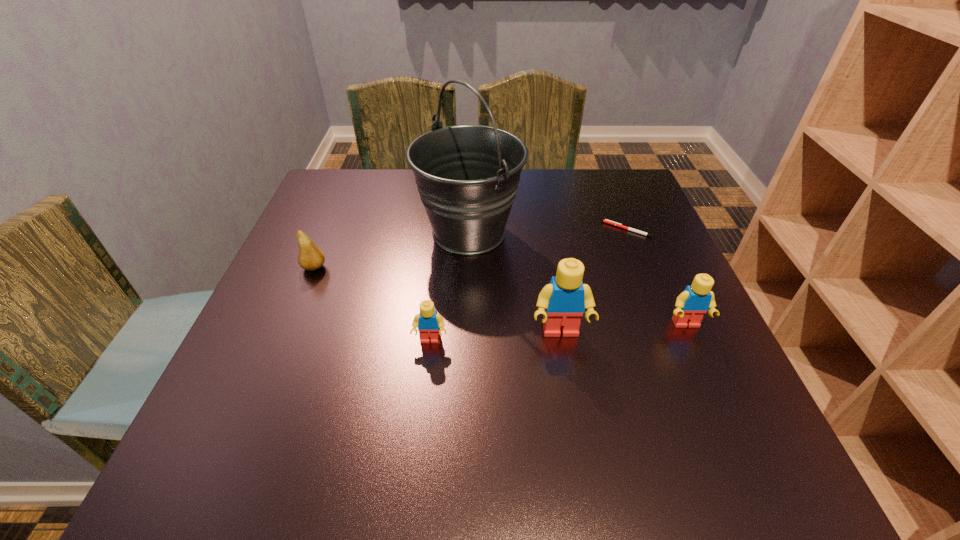
Locate an element on the screen. Image resolution: width=960 pixels, height=540 pixels. vacant space situated 0.150m on the front-facing side of the third tallest object is located at coordinates (720, 402).

At what (x,y) coordinates should I click in order to perform the action: click on vacant area situated on the clicker of the pen. Please return your answer as a coordinate pair (x, y). Looking at the image, I should click on (552, 230).

Where is `vacant space located on the clicker of the pen`? The height and width of the screenshot is (540, 960). vacant space located on the clicker of the pen is located at coordinates (543, 230).

You are a GUI agent. You are given a task and a screenshot of the screen. Output one action in this format:
    pyautogui.click(x=<x>, y=<y>)
    Task: Click on the vacant space located 0.300m on the clicker of the pen
    
    Given the screenshot: What is the action you would take?
    pyautogui.click(x=484, y=230)

Find the location of `vacant region located 0.290m on the left of the tallest object`. vacant region located 0.290m on the left of the tallest object is located at coordinates (300, 233).

Identify the location of vacant space located 0.210m on the front of the pear. (279, 352).

Locate an element on the screen. The width and height of the screenshot is (960, 540). object at the far edge is located at coordinates (467, 176).

You are a GUI agent. You are given a task and a screenshot of the screen. Output one action in this format:
    pyautogui.click(x=<x>, y=<y>)
    Task: Click on the object situated at the left edge
    
    Given the screenshot: What is the action you would take?
    pyautogui.click(x=310, y=257)

Identify the location of Lego that is at the right edge. (691, 305).

Find the location of `pen that is at the right edge`. pen that is at the right edge is located at coordinates (605, 221).